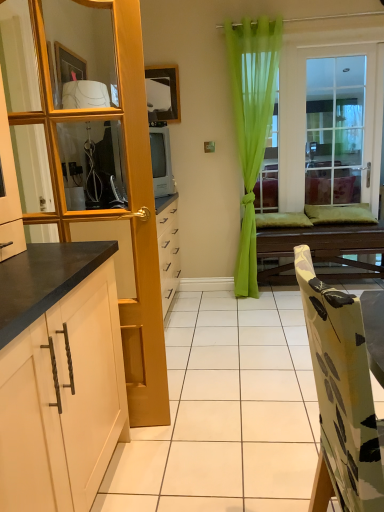
At what (x,y) coordinates should I click in order to perform the action: click on white matte cabinet at left. Please return your answer as a coordinate pair (x, y). Looking at the image, I should click on (91, 158).

Measure the distance between green sheer curtain at center and camera.

A distance of 3.09 meters exists between green sheer curtain at center and camera.

Describe the element at coordinates (252, 124) in the screenshot. I see `green sheer curtain at center` at that location.

This screenshot has width=384, height=512. I want to click on white matte cabinet at left, so click(x=91, y=158).

Which object is closer to the camera taking this photo, clear glass window at center or clear glass mirror at upper left?

Positioned in front is clear glass mirror at upper left.

Looking at this image, is clear glass window at center wider than clear glass mirror at upper left?

In fact, clear glass window at center might be narrower than clear glass mirror at upper left.

The image size is (384, 512). In order to click on window above the clear glass mirror at upper left (from the image's perspective) in this screenshot , I will do `click(329, 126)`.

From the image's perspective, is clear glass window at center below white matte cabinet at left?

Actually, clear glass window at center appears above white matte cabinet at left in the image.

Would you say clear glass window at center is outside white matte cabinet at left?

Yes, clear glass window at center is not within white matte cabinet at left.

Between clear glass window at center and white matte cabinet at left, which one has smaller size?

clear glass window at center.

Does clear glass window at center touch white matte cabinet at left?

No, clear glass window at center is not in contact with white matte cabinet at left.

Considering the sizes of floral fabric chair at lower right and clear glass mirror at upper left in the image, is floral fabric chair at lower right bigger or smaller than clear glass mirror at upper left?

Clearly, floral fabric chair at lower right is larger in size than clear glass mirror at upper left.

Consider the image. Between floral fabric chair at lower right and clear glass mirror at upper left, which one appears on the left side from the viewer's perspective?

clear glass mirror at upper left.

Between floral fabric chair at lower right and clear glass mirror at upper left, which one is positioned behind?

clear glass mirror at upper left is further away from the camera.

From a real-world perspective, who is located lower, floral fabric chair at lower right or clear glass mirror at upper left?

From a 3D spatial view, floral fabric chair at lower right is below.

Relative to wooden table at center, is white matte cabinet at left in front or behind?

white matte cabinet at left is positioned closer to the viewer than wooden table at center.

Is point (124, 302) positioned after point (318, 275)?

No, it is not.

Between white matte cabinet at left and wooden table at center, which one appears on the left side from the viewer's perspective?

white matte cabinet at left.

Between white matte cabinet at left and wooden table at center, which one has smaller size?

white matte cabinet at left.

Is floral fabric chair at lower right wider or thinner than wooden table at center?

Considering their sizes, floral fabric chair at lower right looks slimmer than wooden table at center.

Locate an element on the screen. The image size is (384, 512). chair below the wooden table at center (from the image's perspective) is located at coordinates (341, 395).

Between point (373, 426) and point (339, 261), which one is positioned behind?

The point (339, 261) is behind.

Does wooden table at center appear on the right side of green sheer curtain at center?

Yes.

Is wooden table at center located outside green sheer curtain at center?

That's correct, wooden table at center is outside of green sheer curtain at center.

Considering the sizes of objects wooden table at center and green sheer curtain at center in the image provided, who is taller, wooden table at center or green sheer curtain at center?

green sheer curtain at center is taller.

Which is behind, wooden table at center or green sheer curtain at center?

wooden table at center is further away from the camera.

Would you say clear glass mirror at upper left is a long distance from green sheer curtain at center?

Yes, clear glass mirror at upper left and green sheer curtain at center are quite far apart.

Is clear glass mirror at upper left facing away from green sheer curtain at center?

No, clear glass mirror at upper left is not facing away from green sheer curtain at center.

Consider the image. Does clear glass mirror at upper left come in front of green sheer curtain at center?

Yes.

Where is `mirror in front of the clear glass window at center`? This screenshot has width=384, height=512. mirror in front of the clear glass window at center is located at coordinates (80, 56).

What are the coordinates of `window behind the white matte cabinet at left` in the screenshot? It's located at (329, 126).

Which object lies further to the anchor point wooden table at center, clear glass mirror at upper left or floral fabric chair at lower right?

floral fabric chair at lower right is positioned further to the anchor wooden table at center.

From the image, which object appears to be nearer to floral fabric chair at lower right, white matte cabinet at left or wooden table at center?

white matte cabinet at left is closer to floral fabric chair at lower right.

Considering their positions, is clear glass window at center positioned further to white matte cabinet at left than clear glass mirror at upper left?

clear glass window at center is further to white matte cabinet at left.

From the image, which object appears to be nearer to clear glass window at center, clear glass mirror at upper left or white matte cabinet at left?

clear glass mirror at upper left lies closer to clear glass window at center than the other object.

When comparing their distances from white matte cabinet at left, does clear glass mirror at upper left or floral fabric chair at lower right seem closer?

clear glass mirror at upper left is positioned closer to the anchor white matte cabinet at left.

Based on their spatial positions, is white matte cabinet at left or green sheer curtain at center closer to clear glass window at center?

green sheer curtain at center is closer to clear glass window at center.

Which object lies nearer to the anchor point green sheer curtain at center, wooden table at center or floral fabric chair at lower right?

wooden table at center lies closer to green sheer curtain at center than the other object.

Based on their spatial positions, is green sheer curtain at center or wooden table at center closer to white matte cabinet at left?

green sheer curtain at center.

I want to click on table between white matte cabinet at left and clear glass window at center in the front-back direction, so click(321, 250).

You are a GUI agent. You are given a task and a screenshot of the screen. Output one action in this format:
    pyautogui.click(x=<x>, y=<y>)
    Task: Click on the curtain situated between clear glass mirror at upper left and wooden table at center from left to right
    
    Given the screenshot: What is the action you would take?
    pyautogui.click(x=252, y=124)

Identify the location of cabinetry between floral fabric chair at lower right and green sheer curtain at center along the z-axis. (91, 158).

The width and height of the screenshot is (384, 512). I want to click on curtain between white matte cabinet at left and wooden table at center from front to back, so click(252, 124).